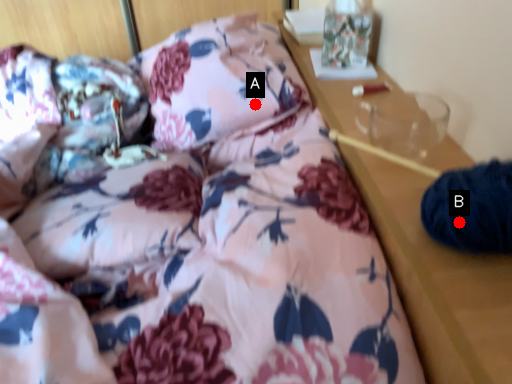
Question: Two points are circled on the image, labeled by A and B beside each circle. Which point is further to the camera?

Choices:
 (A) A is further
 (B) B is further

Answer: (A)